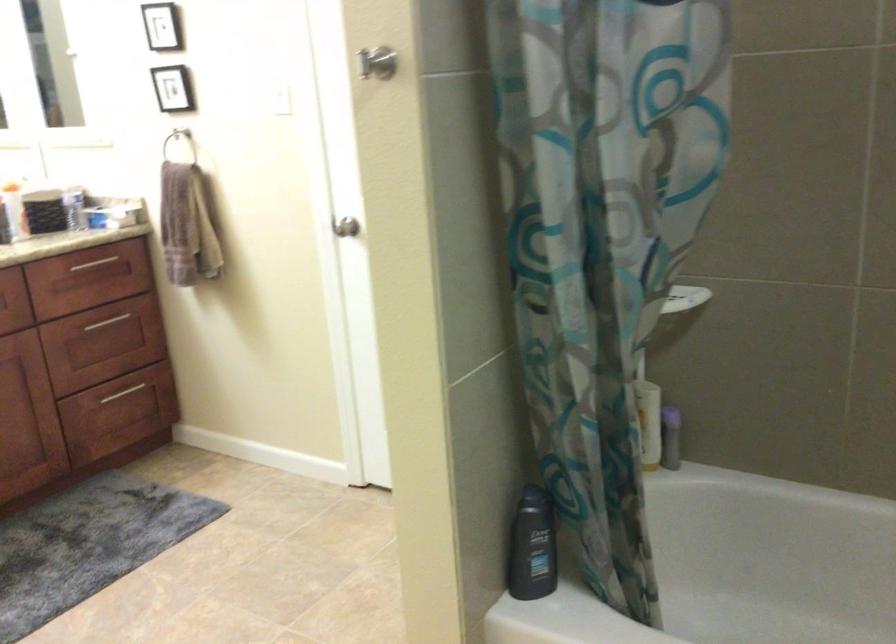
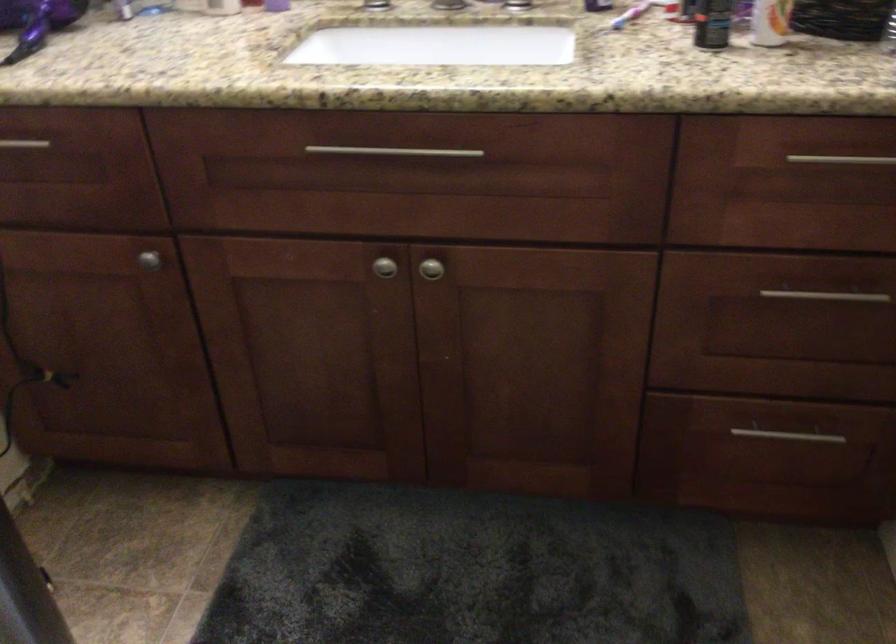
Question: I am providing you with two images of the same scene from different viewpoints. Please identify which objects are invisible in image2.

Choices:
 (A) purple hair dryer
 (B) silver cabinet knob
 (C) silver drawer handle
 (D) none of these

Answer: (D)